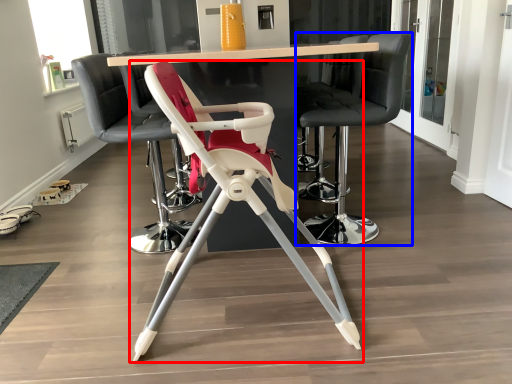
Question: Which object appears closest to the camera in this image, chair (highlighted by a red box) or chair (highlighted by a blue box)?

Choices:
 (A) chair
 (B) chair

Answer: (A)